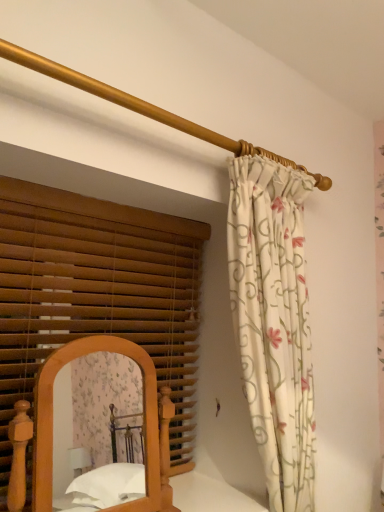
Question: Is gold polished rod at upper center outside wooden bed at lower left?

Choices:
 (A) yes
 (B) no

Answer: (A)

Question: Considering the relative sizes of gold polished rod at upper center and wooden bed at lower left in the image provided, is gold polished rod at upper center smaller than wooden bed at lower left?

Choices:
 (A) no
 (B) yes

Answer: (B)

Question: From the image's perspective, is gold polished rod at upper center beneath wooden bed at lower left?

Choices:
 (A) no
 (B) yes

Answer: (A)

Question: From the image's perspective, is gold polished rod at upper center located above wooden bed at lower left?

Choices:
 (A) yes
 (B) no

Answer: (A)

Question: Is gold polished rod at upper center looking in the opposite direction of wooden bed at lower left?

Choices:
 (A) yes
 (B) no

Answer: (B)

Question: Is floral fabric curtain at upper right in front of or behind wooden bed at lower left in the image?

Choices:
 (A) behind
 (B) front

Answer: (A)

Question: From the image's perspective, is floral fabric curtain at upper right located above or below wooden bed at lower left?

Choices:
 (A) above
 (B) below

Answer: (A)

Question: Do you think floral fabric curtain at upper right is within wooden bed at lower left, or outside of it?

Choices:
 (A) outside
 (B) inside

Answer: (A)

Question: Considering the positions of floral fabric curtain at upper right and wooden bed at lower left in the image, is floral fabric curtain at upper right bigger or smaller than wooden bed at lower left?

Choices:
 (A) big
 (B) small

Answer: (A)

Question: From the image's perspective, is floral fabric curtain at upper right located above or below gold polished rod at upper center?

Choices:
 (A) below
 (B) above

Answer: (A)

Question: Is floral fabric curtain at upper right in front of or behind gold polished rod at upper center in the image?

Choices:
 (A) front
 (B) behind

Answer: (B)

Question: Is point (269, 503) closer or farther from the camera than point (327, 180)?

Choices:
 (A) farther
 (B) closer

Answer: (B)

Question: Considering the positions of floral fabric curtain at upper right and gold polished rod at upper center in the image, is floral fabric curtain at upper right wider or thinner than gold polished rod at upper center?

Choices:
 (A) wide
 (B) thin

Answer: (A)

Question: Based on their sizes in the image, would you say wooden bed at lower left is bigger or smaller than gold polished rod at upper center?

Choices:
 (A) big
 (B) small

Answer: (A)

Question: Is wooden bed at lower left inside the boundaries of gold polished rod at upper center, or outside?

Choices:
 (A) inside
 (B) outside

Answer: (B)